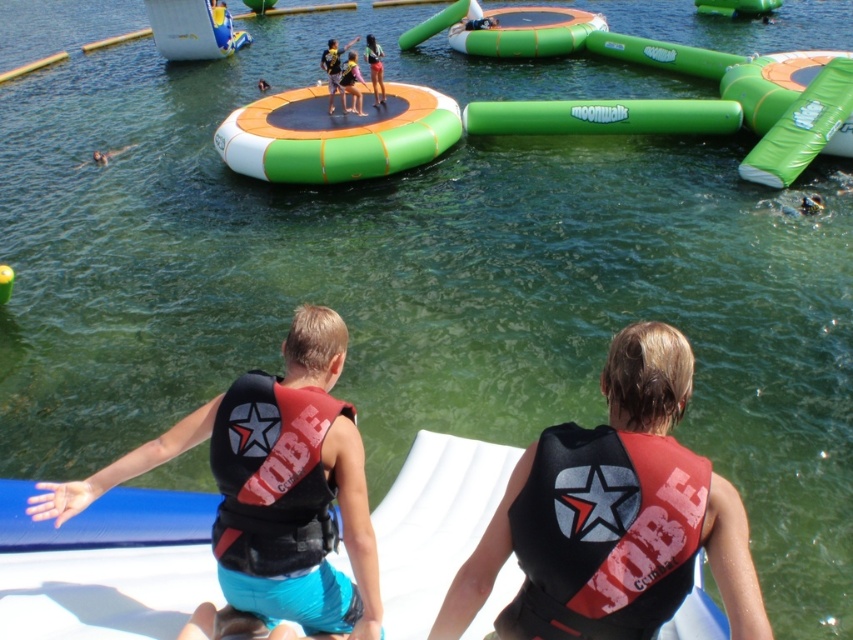
Which is in front, point (582, 429) or point (173, 56)?

Point (582, 429)

Locate an element on the screen. This screenshot has height=640, width=853. black/red life vest at center is located at coordinates tap(613, 516).

Can you confirm if black matte life vest at center is positioned to the right of green inflatable trampoline at center?

Indeed, black matte life vest at center is positioned on the right side of green inflatable trampoline at center.

Is black matte life vest at center bigger than green inflatable trampoline at center?

No, black matte life vest at center is not bigger than green inflatable trampoline at center.

Does point (239, 605) lie in front of point (410, 92)?

Yes, it is in front of point (410, 92).

Identify the location of black matte life vest at center. Image resolution: width=853 pixels, height=640 pixels. (271, 493).

What do you see at coordinates (271, 476) in the screenshot? I see `black/red padded life jacket at center` at bounding box center [271, 476].

Measure the distance between black/red padded life jacket at center and camera.

A distance of 15.43 feet exists between black/red padded life jacket at center and camera.

Between point (329, 401) and point (90, 160), which one is positioned behind?

Point (90, 160)

At what (x,y) coordinates should I click in order to perform the action: click on black/red padded life jacket at center. Please return your answer as a coordinate pair (x, y). Looking at the image, I should click on (271, 476).